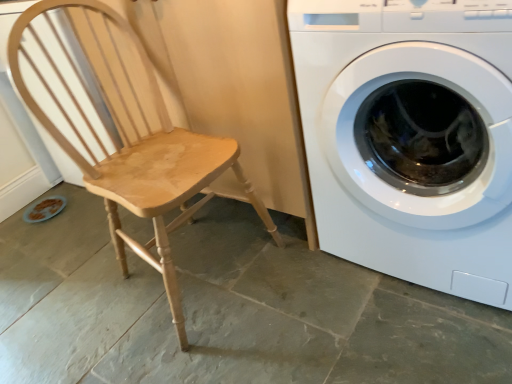
Describe the element at coordinates (411, 137) in the screenshot. I see `white glossy washing machine at right` at that location.

Identify the location of white glossy washing machine at right. This screenshot has width=512, height=384. (411, 137).

In order to face light wood chair at left, should I rotate leftwards or rightwards?

You should rotate left by 13.949 degrees.

Locate an element on the screen. Image resolution: width=512 pixels, height=384 pixels. light wood chair at left is located at coordinates (130, 137).

This screenshot has height=384, width=512. What do you see at coordinates (130, 137) in the screenshot? I see `light wood chair at left` at bounding box center [130, 137].

Locate an element on the screen. The image size is (512, 384). white glossy washing machine at right is located at coordinates (411, 137).

Which is more to the left, white glossy washing machine at right or light wood chair at left?

light wood chair at left is more to the left.

Is white glossy washing machine at right further to camera compared to light wood chair at left?

No, it is in front of light wood chair at left.

Is point (362, 123) in front of point (221, 157)?

Yes, it is.

From the image's perspective, is white glossy washing machine at right above light wood chair at left?

Yes, from the image's perspective, white glossy washing machine at right is on top of light wood chair at left.

From a real-world perspective, is white glossy washing machine at right positioned above or below light wood chair at left?

From a real-world perspective, white glossy washing machine at right is physically below light wood chair at left.

Which object is wider, white glossy washing machine at right or light wood chair at left?

With larger width is white glossy washing machine at right.

Does white glossy washing machine at right have a lesser height compared to light wood chair at left?

Indeed, white glossy washing machine at right has a lesser height compared to light wood chair at left.

Based on their sizes in the image, would you say white glossy washing machine at right is bigger or smaller than light wood chair at left?

white glossy washing machine at right is bigger than light wood chair at left.

Is white glossy washing machine at right inside or outside of light wood chair at left?

white glossy washing machine at right is not inside light wood chair at left, it's outside.

Based on the photo, can you see white glossy washing machine at right touching light wood chair at left?

No, white glossy washing machine at right is not in contact with light wood chair at left.

Is white glossy washing machine at right facing towards light wood chair at left?

No.

How distant is white glossy washing machine at right from light wood chair at left?

A distance of 19.67 inches exists between white glossy washing machine at right and light wood chair at left.

Identify the location of washing machine beneath the light wood chair at left (from a real-world perspective). (411, 137).

Which is more to the left, light wood chair at left or white glossy washing machine at right?

light wood chair at left.

Consider the image. Considering their positions, is light wood chair at left located in front of or behind white glossy washing machine at right?

Clearly, light wood chair at left is behind white glossy washing machine at right.

Does point (144, 212) lie in front of point (358, 211)?

Yes.

From the image's perspective, would you say light wood chair at left is shown under white glossy washing machine at right?

Correct, light wood chair at left appears lower than white glossy washing machine at right in the image.

From a real-world perspective, is light wood chair at left positioned under white glossy washing machine at right based on gravity?

Actually, light wood chair at left is physically above white glossy washing machine at right in the real world.

Is light wood chair at left wider than white glossy washing machine at right?

Incorrect, the width of light wood chair at left does not surpass that of white glossy washing machine at right.

From the picture: Who is taller, light wood chair at left or white glossy washing machine at right?

light wood chair at left is taller.

Looking at this image, who is bigger, light wood chair at left or white glossy washing machine at right?

white glossy washing machine at right is bigger.

Do you think light wood chair at left is within white glossy washing machine at right, or outside of it?

light wood chair at left is outside white glossy washing machine at right.

Is light wood chair at left next to white glossy washing machine at right and touching it?

No, light wood chair at left is not making contact with white glossy washing machine at right.

Is light wood chair at left oriented towards white glossy washing machine at right?

No, light wood chair at left is not oriented towards white glossy washing machine at right.

The width and height of the screenshot is (512, 384). What are the coordinates of `rocking chair on the left of white glossy washing machine at right` in the screenshot? It's located at (130, 137).

Identify the location of washing machine above the light wood chair at left (from the image's perspective). This screenshot has height=384, width=512. (411, 137).

This screenshot has width=512, height=384. I want to click on rocking chair behind the white glossy washing machine at right, so click(x=130, y=137).